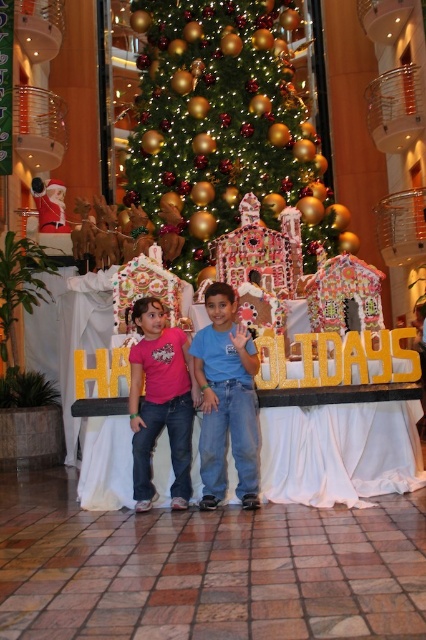
Question: Which is farther from the blue jeans at center?

Choices:
 (A) green shiny christmas tree at center
 (B) pink matte shirt at center

Answer: (A)

Question: Which point appears closest to the camera in this image?

Choices:
 (A) (232, 445)
 (B) (173, 502)
 (C) (224, 204)

Answer: (A)

Question: Which object is the closest to the pink matte shirt at center?

Choices:
 (A) green shiny christmas tree at center
 (B) blue jeans at center

Answer: (B)

Question: Does green shiny christmas tree at center appear on the left side of blue jeans at center?

Choices:
 (A) yes
 (B) no

Answer: (B)

Question: Does green shiny christmas tree at center have a greater width compared to pink matte shirt at center?

Choices:
 (A) no
 (B) yes

Answer: (B)

Question: Does green shiny christmas tree at center have a greater width compared to pink matte shirt at center?

Choices:
 (A) yes
 (B) no

Answer: (A)